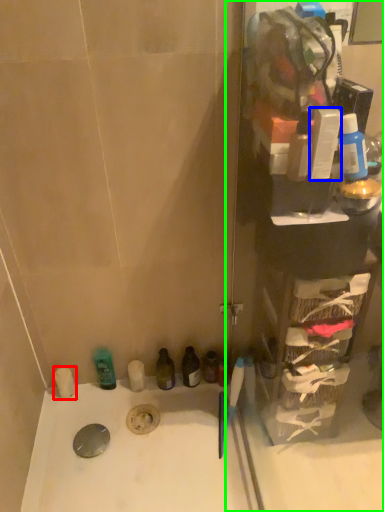
Question: Considering the real-world distances, which object is closest to toiletry (highlighted by a red box)? toiletry (highlighted by a blue box) or glass door (highlighted by a green box).

Choices:
 (A) toiletry
 (B) glass door

Answer: (B)